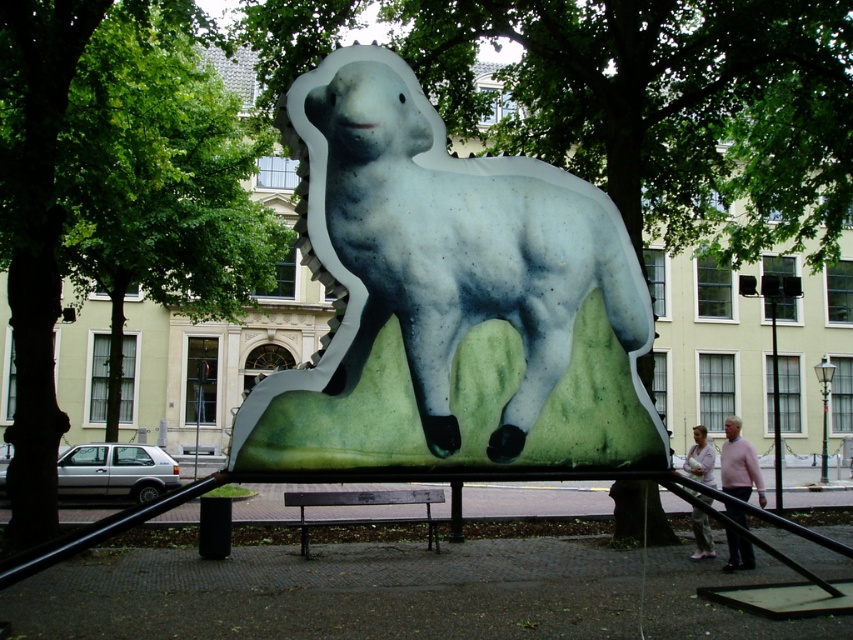
You are standing in front of the sculpture of a sheep in the park. You notice two points on the sculpture labeled as point (x=567, y=371) and point (x=199, y=308). Which point is closer to your eyes?

Point (x=567, y=371) is closer to the camera than point (x=199, y=308), so the point labeled (x=567, y=371) is closer to your eyes.

You are an artist planning to photograph the matte white lamb at center and the green leafy tree at center from a distance. Which object will appear smaller in the photo?

The matte white lamb at center will appear smaller in the photo because its width is less than the green leafy tree at center.

You are an artist planning to paint the scene from a viewpoint where both the matte white lamb at center and the green leafy tree at center are visible. Which object will appear larger in your painting if you maintain the same perspective?

The green leafy tree at center will appear larger in the painting since it is larger than the matte white lamb at center.